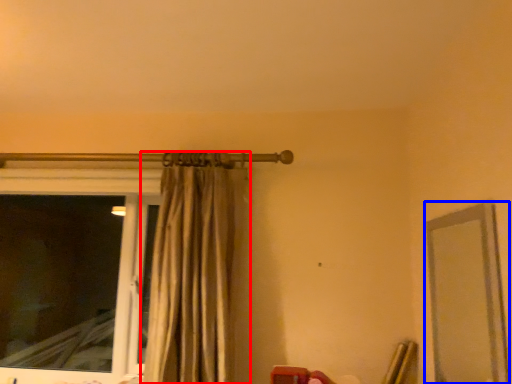
Question: Which object appears farthest to the camera in this image, curtain (highlighted by a red box) or mirror (highlighted by a blue box)?

Choices:
 (A) curtain
 (B) mirror

Answer: (A)